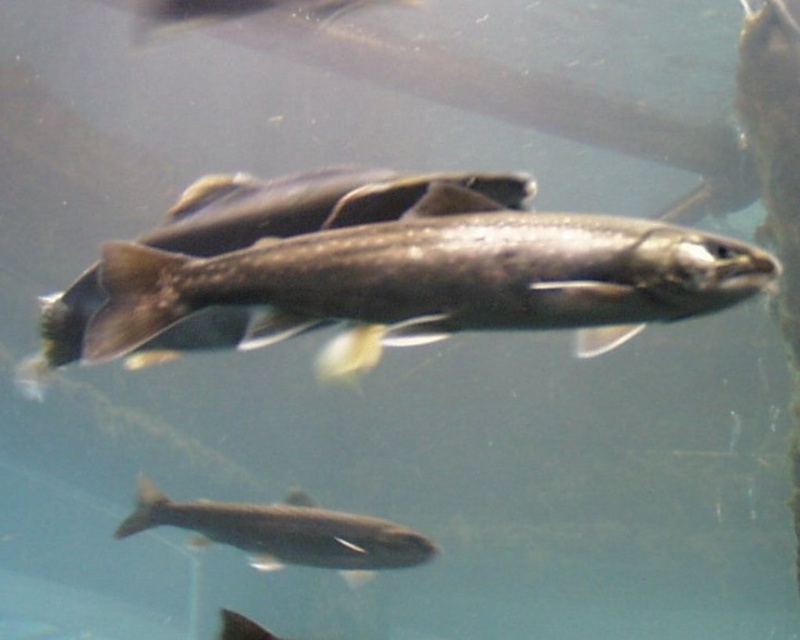
Question: Considering the relative positions of shiny silver fish at center and silvery metallic fish at bottom center in the image provided, where is shiny silver fish at center located with respect to silvery metallic fish at bottom center?

Choices:
 (A) below
 (B) above

Answer: (B)

Question: Among these objects, which one is farthest from the camera?

Choices:
 (A) shiny silver fish at center
 (B) silvery metallic fish at bottom center

Answer: (B)

Question: Can you confirm if shiny silver fish at center is positioned to the right of silvery metallic fish at bottom center?

Choices:
 (A) yes
 (B) no

Answer: (A)

Question: Which of the following is the closest to the observer?

Choices:
 (A) silvery metallic fish at bottom center
 (B) shiny silver fish at center

Answer: (B)

Question: Is shiny silver fish at center smaller than silvery metallic fish at bottom center?

Choices:
 (A) yes
 (B) no

Answer: (A)

Question: Among these objects, which one is nearest to the camera?

Choices:
 (A) silvery metallic fish at bottom center
 (B) shiny silver fish at center

Answer: (B)